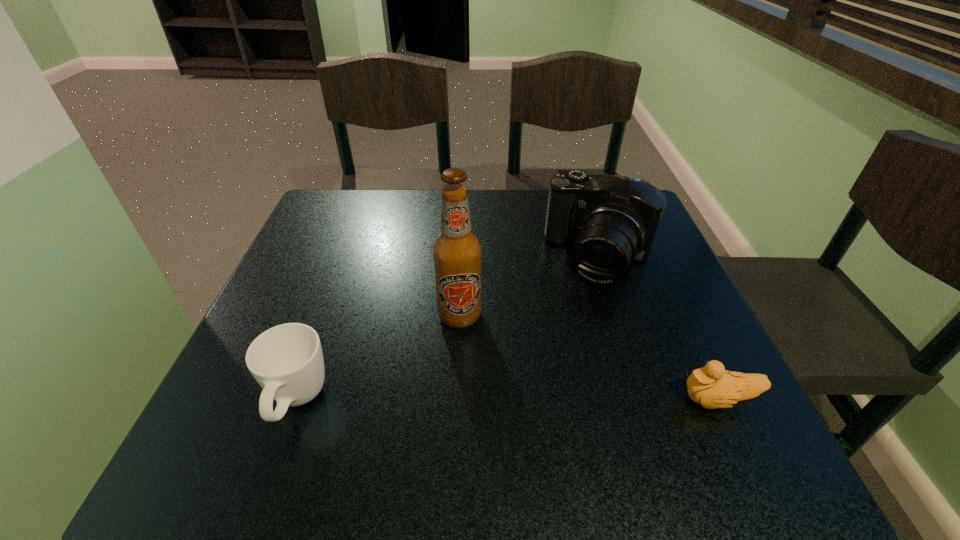
Identify the location of free spot between the farthest object and the tallest object. (530, 286).

This screenshot has width=960, height=540. What are the coordinates of `free space between the cup and the camera` in the screenshot? It's located at (448, 329).

What are the coordinates of `free space that is in between the duckling and the third shortest object` in the screenshot? It's located at (659, 328).

This screenshot has height=540, width=960. Identify the location of empty space that is in between the tallest object and the second tallest object. (530, 286).

Identify the location of free space between the farthest object and the shortest object. Image resolution: width=960 pixels, height=540 pixels. (659, 328).

In order to click on vacant point located between the cup and the tallest object in this screenshot , I will do `click(378, 359)`.

Identify the location of vacant space that's between the farthest object and the shortest object. (659, 328).

Where is `free spot between the beer bottle and the second tallest object`? free spot between the beer bottle and the second tallest object is located at coordinates (530, 286).

Locate an element on the screen. free space between the shortest object and the third shortest object is located at coordinates (659, 328).

The height and width of the screenshot is (540, 960). In order to click on vacant space in between the shortest object and the camera in this screenshot , I will do `click(659, 328)`.